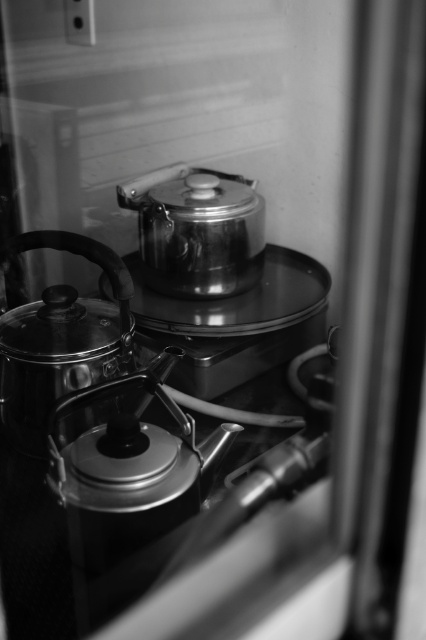
Looking at this image, does shiny metallic teapot at center have a greater width compared to shiny metallic pot at center?

In fact, shiny metallic teapot at center might be narrower than shiny metallic pot at center.

Is shiny metallic teapot at center above shiny metallic pot at center?

Actually, shiny metallic teapot at center is below shiny metallic pot at center.

Identify the location of shiny metallic teapot at center. The width and height of the screenshot is (426, 640). (129, 470).

In order to click on shiny metallic teapot at center in this screenshot , I will do pyautogui.click(x=129, y=470).

Who is taller, shiny metallic teapot at center or shiny metallic kettle at left?

With more height is shiny metallic kettle at left.

The image size is (426, 640). In order to click on shiny metallic teapot at center in this screenshot , I will do `click(129, 470)`.

What do you see at coordinates (235, 323) in the screenshot? I see `shiny metallic pot at center` at bounding box center [235, 323].

Is shiny metallic pot at center taller than shiny metallic kettle at left?

No, shiny metallic pot at center is not taller than shiny metallic kettle at left.

What do you see at coordinates (235, 323) in the screenshot? I see `shiny metallic pot at center` at bounding box center [235, 323].

The height and width of the screenshot is (640, 426). Find the location of `shiny metallic pot at center`. shiny metallic pot at center is located at coordinates (235, 323).